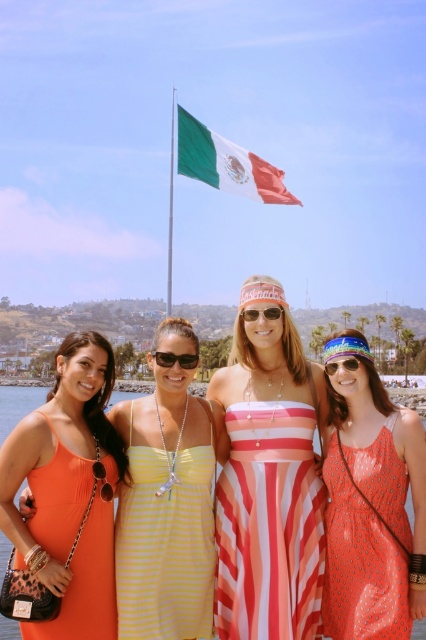
Between point (215, 138) and point (356, 369), which one is positioned behind?

The point (215, 138) is behind.

Can you confirm if green and white striped fabric at upper center is positioned below clear plastic sunglasses at center?

No, green and white striped fabric at upper center is not below clear plastic sunglasses at center.

The image size is (426, 640). What are the coordinates of `green and white striped fabric at upper center` in the screenshot? It's located at (227, 163).

This screenshot has width=426, height=640. Identify the location of green and white striped fabric at upper center. (227, 163).

Can you confirm if orange dotted fabric dress at lower right is smaller than green metallic flag pole at upper center?

Yes.

Which is above, orange dotted fabric dress at lower right or green metallic flag pole at upper center?

Positioned higher is green metallic flag pole at upper center.

Does point (371, 461) lie behind point (169, 310)?

No.

This screenshot has height=640, width=426. Find the location of `orange dotted fabric dress at lower right`. orange dotted fabric dress at lower right is located at coordinates (365, 541).

Can you confirm if green metallic flag pole at upper center is thinner than sunglasses at center?

Incorrect, green metallic flag pole at upper center's width is not less than sunglasses at center's.

Is green metallic flag pole at upper center above sunglasses at center?

Indeed, green metallic flag pole at upper center is positioned over sunglasses at center.

Which is behind, point (169, 259) or point (189, 369)?

Point (169, 259)

This screenshot has height=640, width=426. Identify the location of green metallic flag pole at upper center. (170, 211).